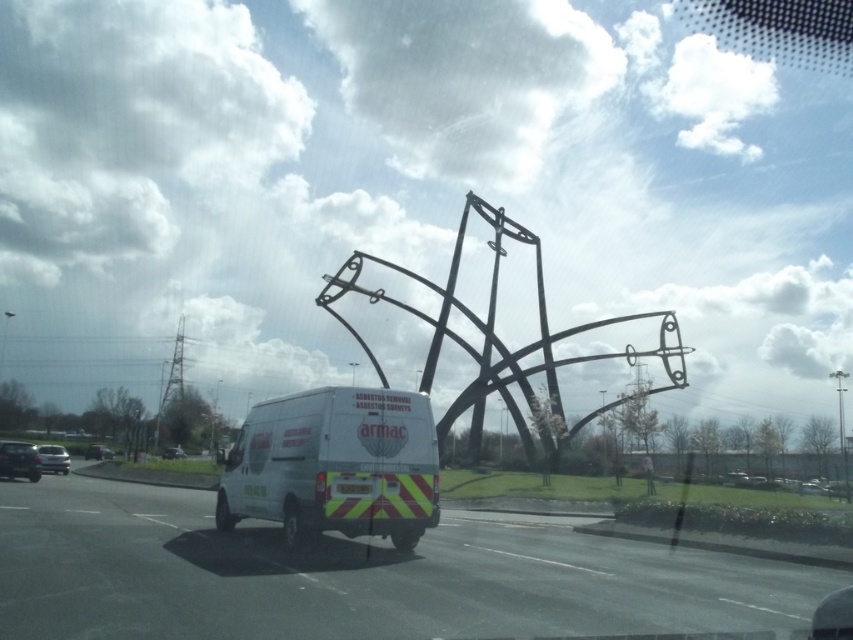
Does white van at center have a lesser height compared to shiny black car at lower left?

In fact, white van at center may be taller than shiny black car at lower left.

Does white van at center have a lesser width compared to shiny black car at lower left?

No, white van at center is not thinner than shiny black car at lower left.

Does point (572, 621) lie behind point (86, 458)?

That is False.

Where is `white van at center`? This screenshot has height=640, width=853. white van at center is located at coordinates (357, 577).

Who is positioned more to the right, white matte van at center or shiny silver car at lower left?

white matte van at center is more to the right.

Who is positioned more to the left, white matte van at center or shiny silver car at lower left?

shiny silver car at lower left is more to the left.

Measure the distance between white matte van at center and camera.

The distance of white matte van at center from camera is 13.53 meters.

Where is `white matte van at center`? This screenshot has width=853, height=640. white matte van at center is located at coordinates (335, 465).

Is point (364, 529) farther from camera compared to point (171, 449)?

No, (364, 529) is closer to viewer.

Image resolution: width=853 pixels, height=640 pixels. Describe the element at coordinates (335, 465) in the screenshot. I see `white matte van at center` at that location.

Which is in front, point (346, 403) or point (165, 454)?

Point (346, 403) is more forward.

In order to click on white matte van at center in this screenshot , I will do `click(335, 465)`.